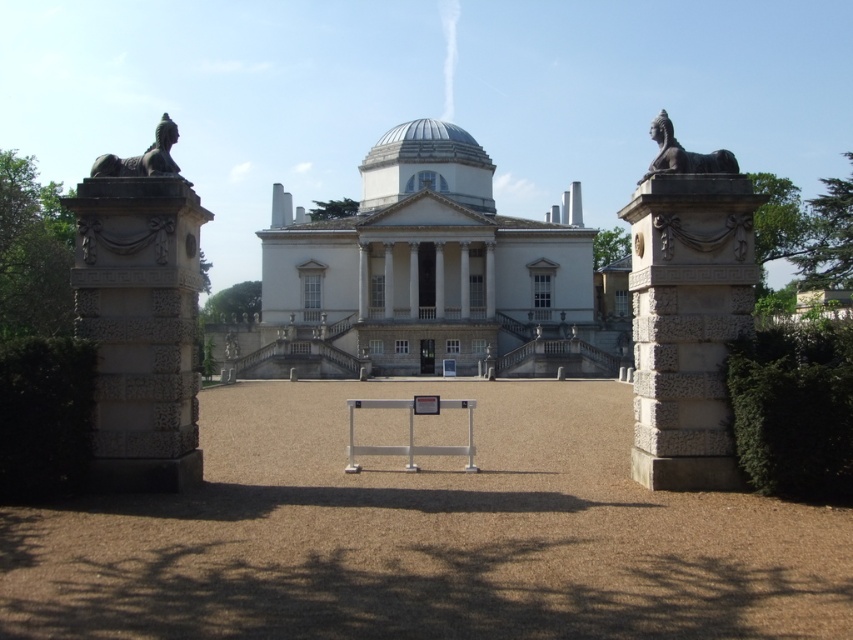
Question: Does marble statue at right have a greater width compared to white glossy dome at center?

Choices:
 (A) yes
 (B) no

Answer: (B)

Question: Which point is closer to the camera taking this photo?

Choices:
 (A) (672, 468)
 (B) (659, 116)

Answer: (A)

Question: Is bronze statue at right below bronze statue at left?

Choices:
 (A) no
 (B) yes

Answer: (A)

Question: Which point appears farthest from the camera in this image?

Choices:
 (A) (164, 116)
 (B) (160, 396)
 (C) (432, 154)

Answer: (C)

Question: Among these points, which one is farthest from the camera?

Choices:
 (A) (167, 132)
 (B) (358, 208)
 (C) (679, 157)
 (D) (459, 157)

Answer: (B)

Question: Can you confirm if marble statue at right is positioned to the right of white glossy dome at center?

Choices:
 (A) yes
 (B) no

Answer: (A)